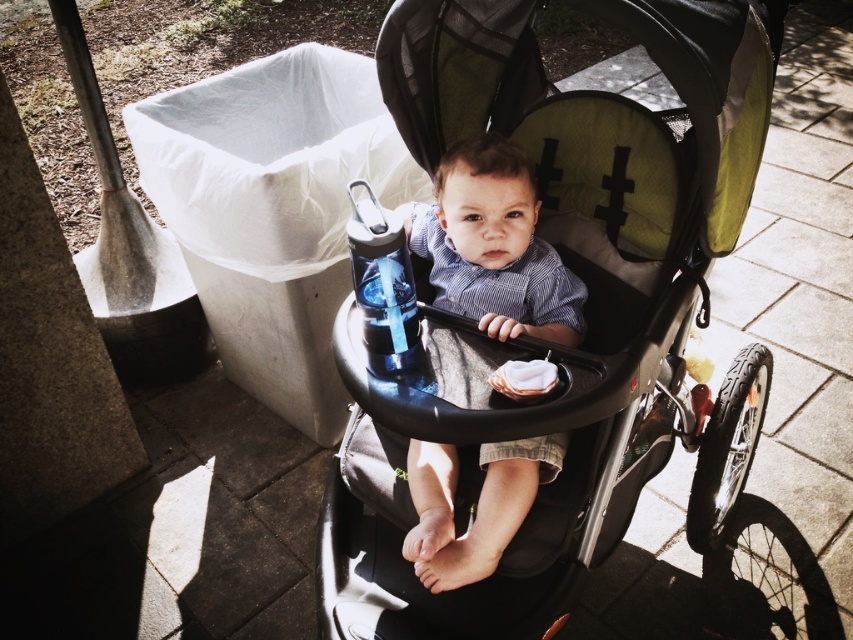
Question: Does matte black stroller at center appear on the left side of matte blue shirt at center?

Choices:
 (A) yes
 (B) no

Answer: (B)

Question: In this image, where is matte black stroller at center located relative to matte blue shirt at center?

Choices:
 (A) below
 (B) above

Answer: (A)

Question: Among these points, which one is farthest from the camera?

Choices:
 (A) (498, 193)
 (B) (537, 227)

Answer: (B)

Question: Is matte black stroller at center behind matte blue shirt at center?

Choices:
 (A) yes
 (B) no

Answer: (B)

Question: Among these points, which one is nearest to the camera?

Choices:
 (A) (428, 566)
 (B) (351, 516)

Answer: (A)